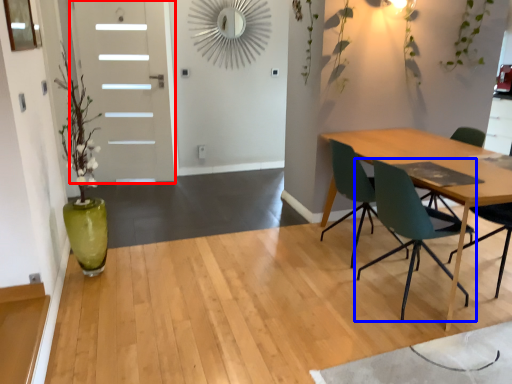
Question: Which object appears farthest to the camera in this image, door (highlighted by a red box) or chair (highlighted by a blue box)?

Choices:
 (A) door
 (B) chair

Answer: (A)